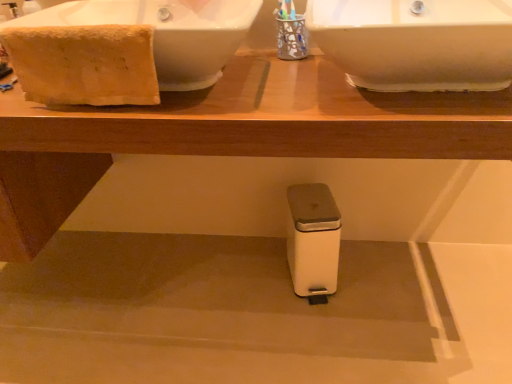
Question: From a real-world perspective, is white glossy sink at upper left, which ranks as the 2th sink in right-to-left order, located beneath beige cotton towel at upper left?

Choices:
 (A) no
 (B) yes

Answer: (B)

Question: Is white glossy sink at upper left, which ranks as the 2th sink in right-to-left order, completely or partially outside of beige cotton towel at upper left?

Choices:
 (A) no
 (B) yes

Answer: (B)

Question: Could beige cotton towel at upper left be considered to be inside white glossy sink at upper left, which is counted as the first sink, starting from the left?

Choices:
 (A) no
 (B) yes

Answer: (B)

Question: Is white glossy sink at upper left, which ranks as the 2th sink in right-to-left order, facing towards beige cotton towel at upper left?

Choices:
 (A) no
 (B) yes

Answer: (B)

Question: Is white glossy sink at upper left, which ranks as the 2th sink in right-to-left order, shorter than beige cotton towel at upper left?

Choices:
 (A) no
 (B) yes

Answer: (A)

Question: Is white glossy sink at upper left, which ranks as the 2th sink in right-to-left order, further to the viewer compared to beige cotton towel at upper left?

Choices:
 (A) no
 (B) yes

Answer: (A)

Question: Is white glossy sink at upper right, the 2th sink from the left, aimed at beige cotton towel at upper left?

Choices:
 (A) yes
 (B) no

Answer: (B)

Question: From the image's perspective, would you say white glossy sink at upper right, acting as the first sink starting from the right, is shown under beige cotton towel at upper left?

Choices:
 (A) yes
 (B) no

Answer: (B)

Question: Does white glossy sink at upper right, acting as the first sink starting from the right, have a greater width compared to beige cotton towel at upper left?

Choices:
 (A) yes
 (B) no

Answer: (A)

Question: Is white glossy sink at upper right, acting as the first sink starting from the right, at the right side of beige cotton towel at upper left?

Choices:
 (A) yes
 (B) no

Answer: (A)

Question: Is white glossy sink at upper right, the 2th sink from the left, thinner than beige cotton towel at upper left?

Choices:
 (A) yes
 (B) no

Answer: (B)

Question: Is white glossy sink at upper left, which ranks as the 2th sink in right-to-left order, at the right side of white plastic table at center?

Choices:
 (A) no
 (B) yes

Answer: (A)